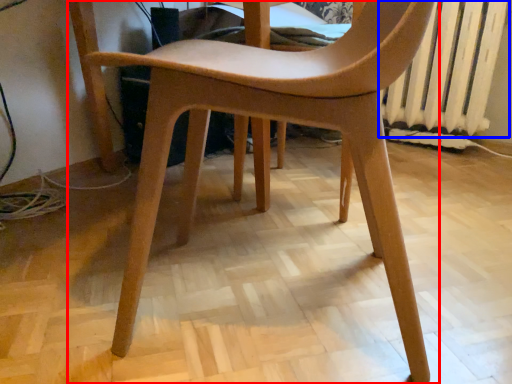
Question: Among these objects, which one is nearest to the camera, chair (highlighted by a red box) or radiator (highlighted by a blue box)?

Choices:
 (A) chair
 (B) radiator

Answer: (A)